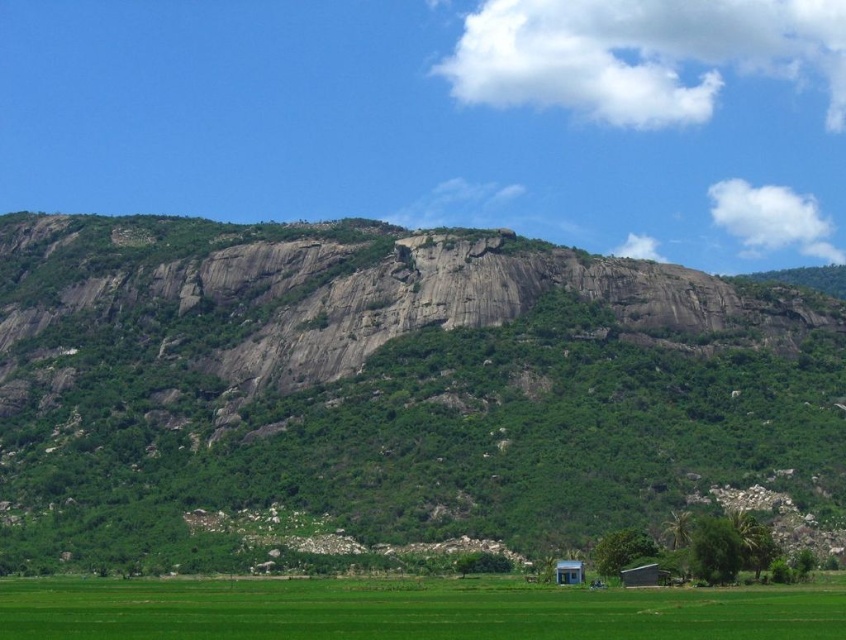
Does gray rock mountain at center have a lesser height compared to green grass field at lower center?

Incorrect, gray rock mountain at center's height does not fall short of green grass field at lower center's.

Looking at this image, between gray rock mountain at center and green grass field at lower center, which one is positioned lower?

green grass field at lower center is lower down.

Which is in front, point (684, 388) or point (709, 616)?

Point (709, 616)

The width and height of the screenshot is (846, 640). What are the coordinates of `gray rock mountain at center` in the screenshot? It's located at 393,392.

Does point (235, 608) come behind point (644, 586)?

That is False.

Can you confirm if green grass field at lower center is bigger than white corrugated metal hut at lower right?

Correct, green grass field at lower center is larger in size than white corrugated metal hut at lower right.

The height and width of the screenshot is (640, 846). What do you see at coordinates (410, 611) in the screenshot?
I see `green grass field at lower center` at bounding box center [410, 611].

The width and height of the screenshot is (846, 640). I want to click on green grass field at lower center, so click(410, 611).

Can you confirm if white corrugated metal hut at lower right is thinner than blue painted wood hut at lower center?

In fact, white corrugated metal hut at lower right might be wider than blue painted wood hut at lower center.

Describe the element at coordinates (645, 576) in the screenshot. This screenshot has height=640, width=846. I see `white corrugated metal hut at lower right` at that location.

Describe the element at coordinates (645, 576) in the screenshot. I see `white corrugated metal hut at lower right` at that location.

Locate an element on the screen. This screenshot has width=846, height=640. white corrugated metal hut at lower right is located at coordinates (645, 576).